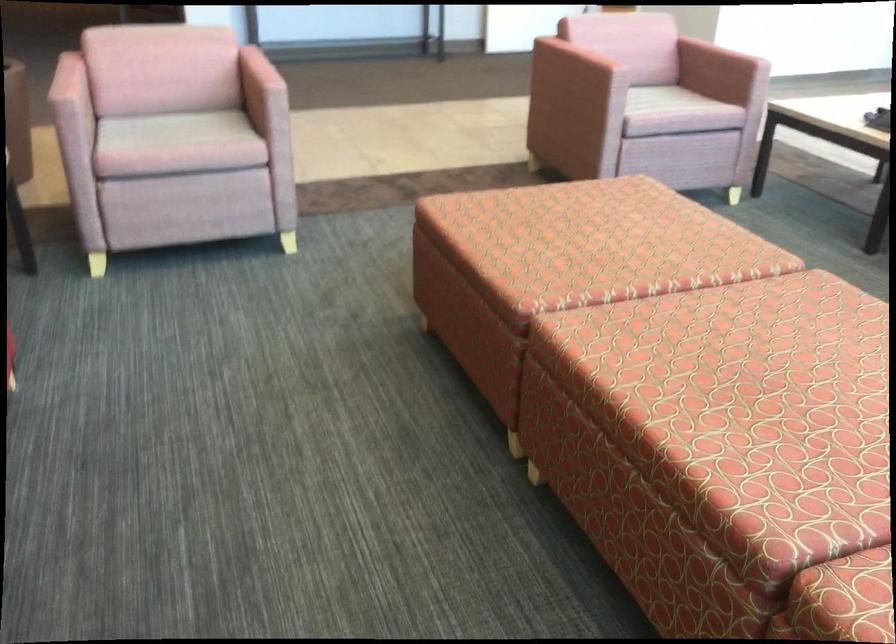
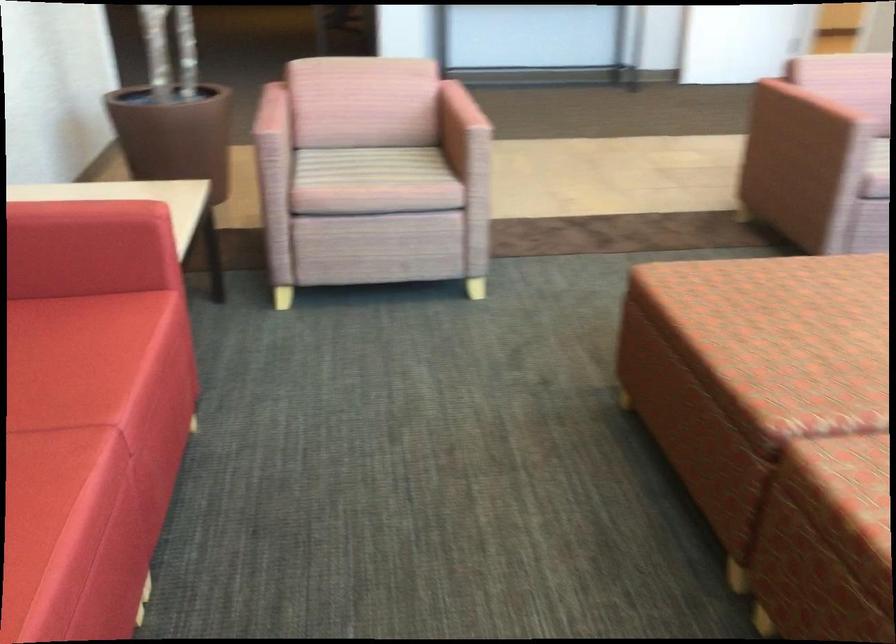
The images are taken continuously from a first-person perspective. In which direction are you moving?

The movement direction of the cameraman is left, forward.